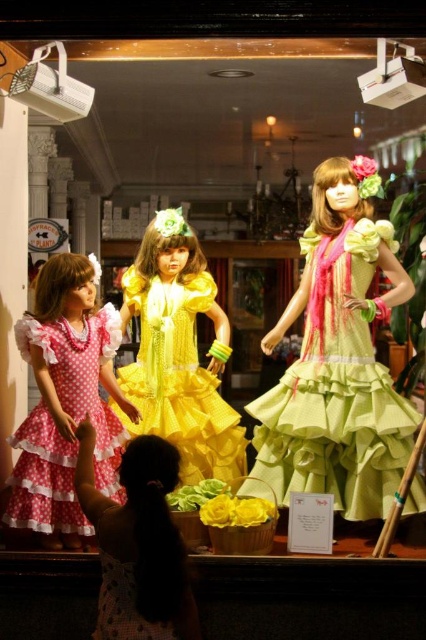
Question: Observing the image, what is the correct spatial positioning of yellow satin dress at center in reference to pink polka dot fabric dress at left?

Choices:
 (A) left
 (B) right

Answer: (B)

Question: Is yellow satin dress at center above dotted fabric dress at lower left?

Choices:
 (A) yes
 (B) no

Answer: (A)

Question: Which of the following is the farthest from the observer?

Choices:
 (A) dotted fabric dress at lower left
 (B) yellow satin dress at center

Answer: (B)

Question: Is yellow satin dress at center below pink polka dot dress at lower left?

Choices:
 (A) no
 (B) yes

Answer: (A)

Question: Which point is farther to the camera?

Choices:
 (A) pos(328,424)
 (B) pos(166,428)
 (C) pos(106,464)
 (D) pos(104,538)

Answer: (B)

Question: Which point is closer to the camera taking this photo?

Choices:
 (A) (138, 369)
 (B) (146, 541)
 (C) (129, 508)
 (D) (112, 451)

Answer: (B)